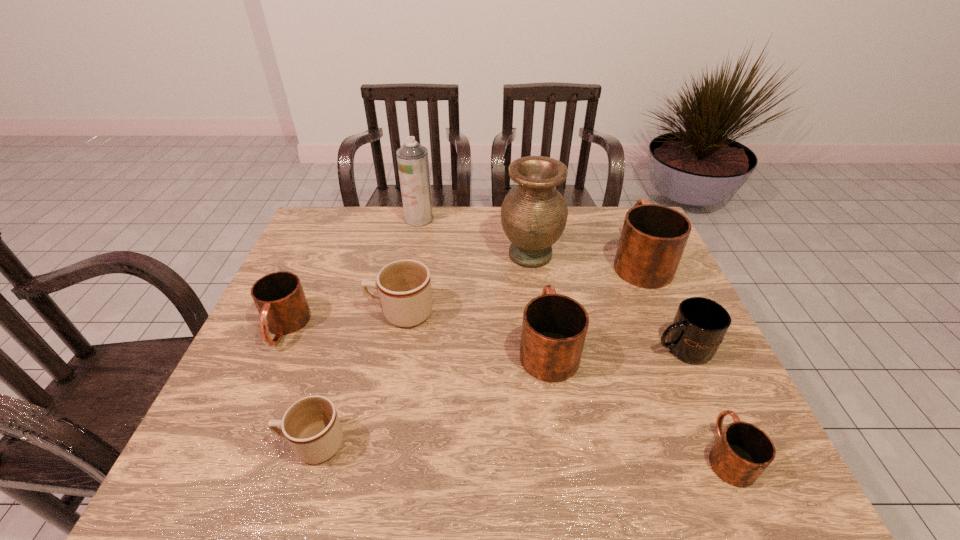
Locate an element on the screen. This screenshot has width=960, height=540. vacant area at the left edge is located at coordinates (337, 275).

Locate an element on the screen. The height and width of the screenshot is (540, 960). free space at the near left corner of the desktop is located at coordinates (225, 449).

In the image, there is a desktop. Where is `vacant space at the far right corner`? The image size is (960, 540). vacant space at the far right corner is located at coordinates (629, 206).

The height and width of the screenshot is (540, 960). In order to click on vacant space at the near right corner of the desktop in this screenshot , I will do `click(756, 487)`.

Where is `empty space that is in between the smallest rust mug and the second smallest rust mug`? This screenshot has height=540, width=960. empty space that is in between the smallest rust mug and the second smallest rust mug is located at coordinates (506, 391).

At what (x,y) coordinates should I click in order to perform the action: click on vacant space in between the vase and the aerosol can. Please return your answer as a coordinate pair (x, y). Looking at the image, I should click on (474, 237).

Identify the location of free space between the bigger brown mug and the green vase. (466, 284).

The height and width of the screenshot is (540, 960). What are the coordinates of `vacant area that lies between the third rust mug from right to left and the second smallest rust mug` in the screenshot? It's located at (416, 336).

Locate an element on the screen. blank region between the seventh shortest object and the black mug is located at coordinates (660, 304).

Where is `vacant point located between the black mug and the tallest mug`? The height and width of the screenshot is (540, 960). vacant point located between the black mug and the tallest mug is located at coordinates (660, 304).